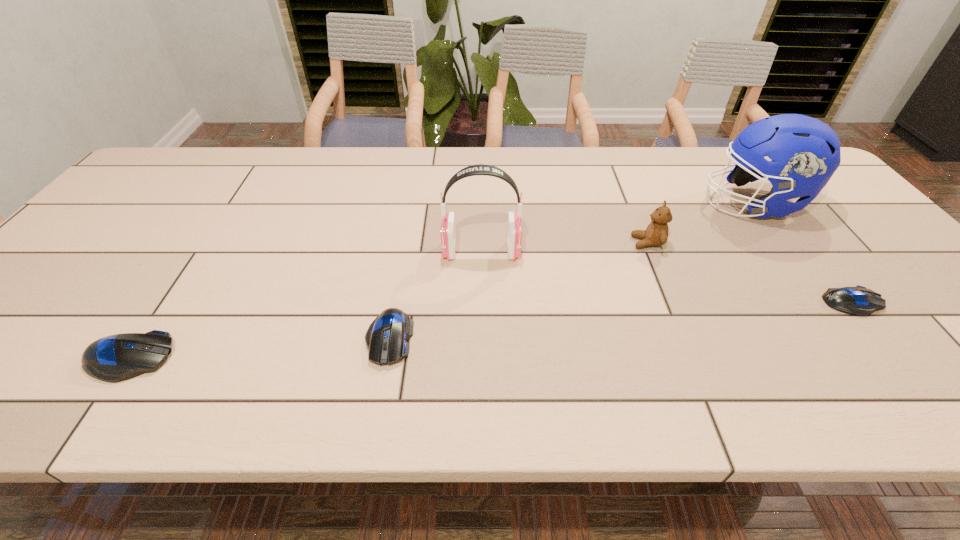
At what (x,y) coordinates should I click in order to perform the action: click on object that is positioned at the far edge. Please return your answer as a coordinate pair (x, y). Looking at the image, I should click on (805, 152).

Identify the location of computer mouse that is at the right edge. (860, 301).

What are the coordinates of `football helmet positioned at the right edge` in the screenshot? It's located at click(x=805, y=152).

At what (x,y) coordinates should I click in order to perform the action: click on object that is at the far right corner. Please return your answer as a coordinate pair (x, y). Image resolution: width=960 pixels, height=540 pixels. Looking at the image, I should click on (805, 152).

Locate an element on the screen. Image resolution: width=960 pixels, height=540 pixels. vacant space at the far edge of the desktop is located at coordinates pyautogui.click(x=542, y=185).

The height and width of the screenshot is (540, 960). Find the location of `vacant space at the near edge of the desktop`. vacant space at the near edge of the desktop is located at coordinates (438, 327).

This screenshot has width=960, height=540. In order to click on vacant area at the far left corner in this screenshot , I will do `click(140, 181)`.

Where is `free point between the second object from left to right and the teddy bear`? This screenshot has width=960, height=540. free point between the second object from left to right and the teddy bear is located at coordinates (518, 291).

At what (x,y) coordinates should I click in order to perform the action: click on vacant area between the second tallest computer mouse and the leftmost computer mouse. Please return your answer as a coordinate pair (x, y). Looking at the image, I should click on (259, 348).

This screenshot has height=540, width=960. I want to click on vacant space in between the fourth object from right to left and the second computer mouse from right to left, so click(x=435, y=295).